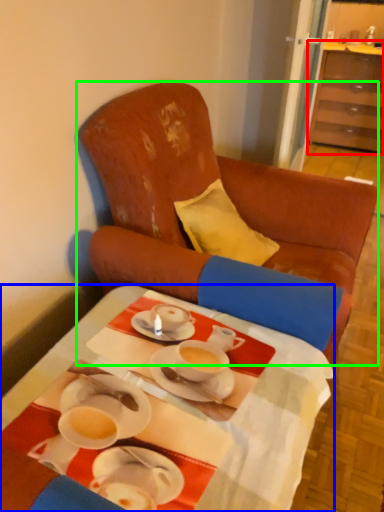
Question: Which object is positioned closest to cabinetry (highlighted by a red box)? Select from desk (highlighted by a blue box) and chair (highlighted by a green box).

Choices:
 (A) desk
 (B) chair

Answer: (B)